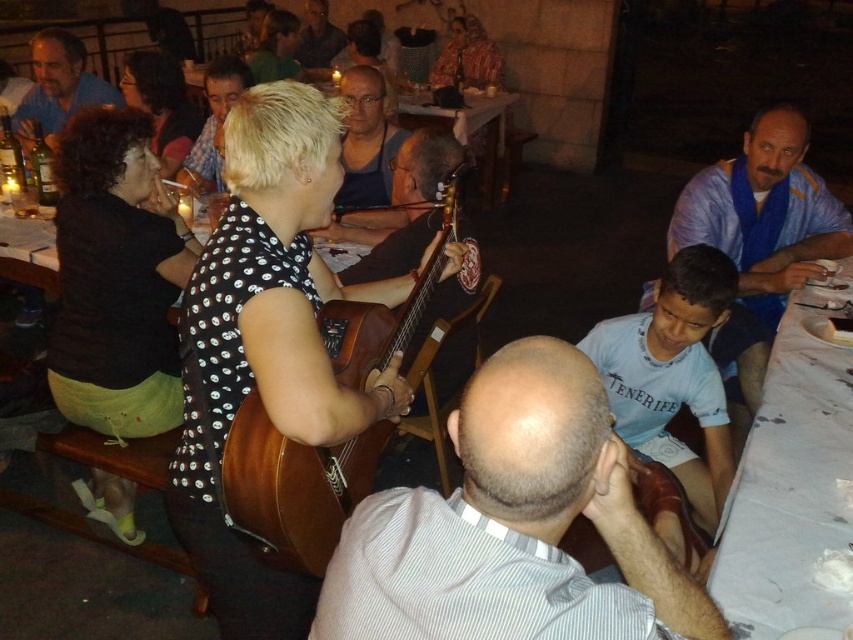
Question: Does blonde hair at center appear over matte black guitar at center?

Choices:
 (A) no
 (B) yes

Answer: (A)

Question: Which of the following is the farthest from the observer?

Choices:
 (A) (343, 186)
 (B) (22, 99)

Answer: (B)

Question: Which point is closer to the camera?

Choices:
 (A) (316, 67)
 (B) (45, 64)

Answer: (B)

Question: Does brown wooden guitar at center have a larger size compared to light blue cotton shirt at lower right?

Choices:
 (A) yes
 (B) no

Answer: (A)

Question: Is the position of matte blue shirt at upper left more distant than that of matte black guitar at center?

Choices:
 (A) no
 (B) yes

Answer: (A)

Question: Which point is farther from the camera taking this photo?

Choices:
 (A) (698, 289)
 (B) (366, 84)
 (C) (286, 557)
 (D) (686, 205)

Answer: (B)